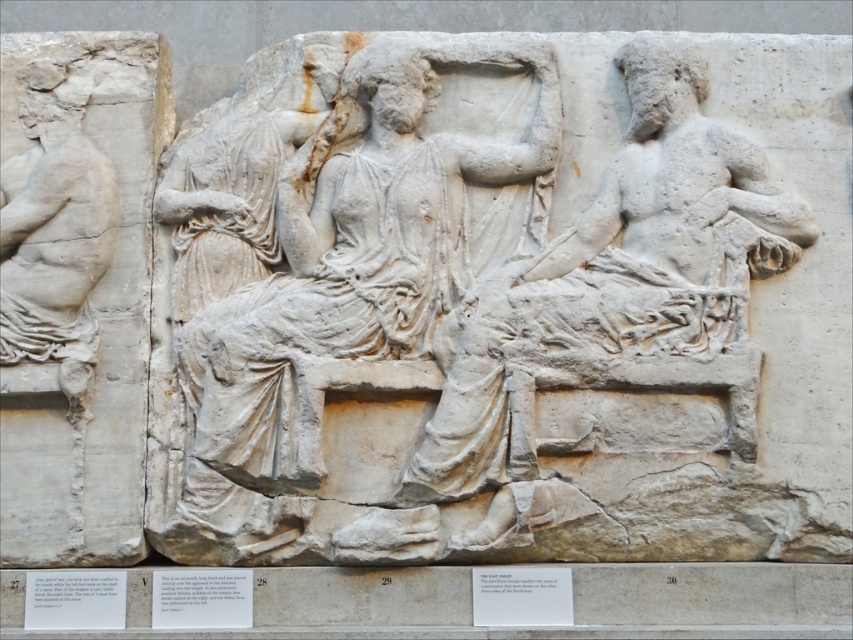
Based on the coordinates provided in the Objects Description, where is the white marble figure at center located in the relief sculpture?

The white marble figure at center is located at the coordinates point (366, 246) in the relief sculpture.

In the scene shown: In the classical relief sculpture, there are two central figures carved into the stone block. The first is the white marble figure at center, and the second is the white stone figure at center. From your perspective as an observer standing in front of the relief, which of these two figures appears closer to you?

The white marble figure at center appears closer to you because it is positioned further to the viewer than the white stone figure at center in the relief sculpture.

You are an archaeologist examining a classical relief sculpture from ancient Greece or Rome. The relief is carved into a large weathered stone block. You notice the white stone figure at center. Given that the figure is 110.26 feet away from your current position, can you safely approach it without damaging the fragile sculpture?

The white stone figure at center is 110.26 feet away from the camera. Since this distance is quite far, you can safely approach it without causing damage to the fragile sculpture as long as you maintain proper precautions and follow conservation guidelines.